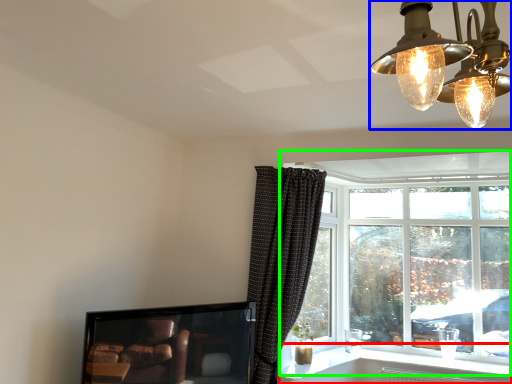
Question: Based on their relative distances, which object is nearer to window sill (highlighted by a red box)? Choose from lamp (highlighted by a blue box) and window (highlighted by a green box).

Choices:
 (A) lamp
 (B) window

Answer: (B)